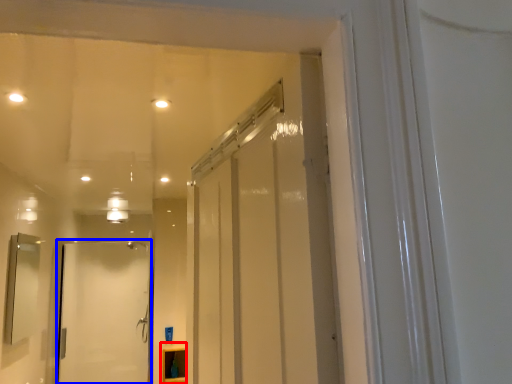
Question: Among these objects, which one is nearest to the camera, cabinetry (highlighted by a red box) or door (highlighted by a blue box)?

Choices:
 (A) cabinetry
 (B) door

Answer: (A)